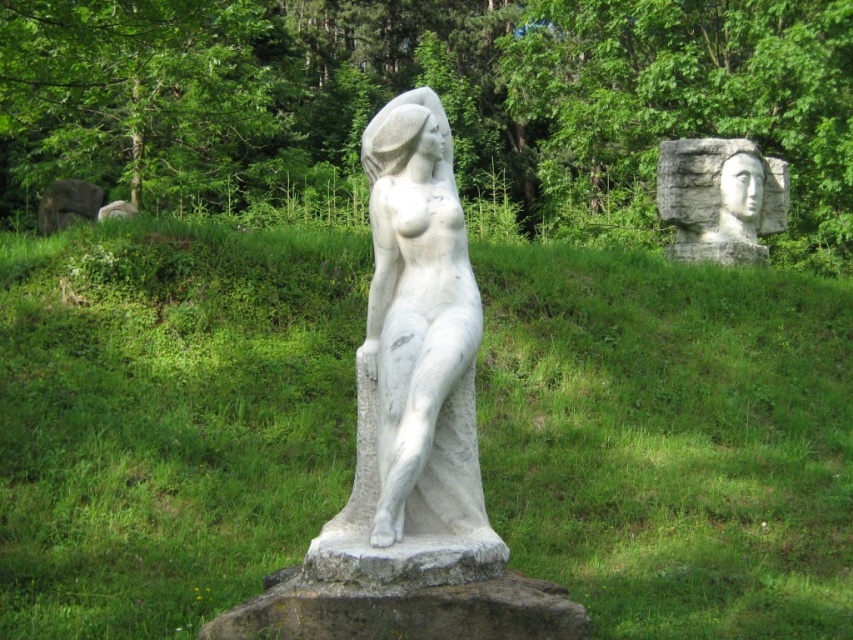
Which is below, green grass at center or white marble statue at center?

green grass at center is lower down.

Based on the photo, does green grass at center have a smaller size compared to white marble statue at center?

Actually, green grass at center might be larger than white marble statue at center.

Who is more distant from viewer, (177, 570) or (422, 317)?

The point (177, 570) is behind.

You are a GUI agent. You are given a task and a screenshot of the screen. Output one action in this format:
    pyautogui.click(x=<x>, y=<y>)
    Task: Click on the green grass at center
    Image resolution: width=853 pixels, height=640 pixels.
    Given the screenshot: What is the action you would take?
    pyautogui.click(x=167, y=419)

Which is more to the right, white marble statue at center or white stone head at upper right?

From the viewer's perspective, white stone head at upper right appears more on the right side.

Can you confirm if white marble statue at center is wider than white stone head at upper right?

No, white marble statue at center is not wider than white stone head at upper right.

This screenshot has width=853, height=640. Find the location of `white marble statue at center`. white marble statue at center is located at coordinates (413, 372).

The image size is (853, 640). I want to click on white marble statue at center, so click(x=413, y=372).

Is green grass at center bigger than white stone head at upper right?

Yes.

Where is `green grass at center`? green grass at center is located at coordinates (167, 419).